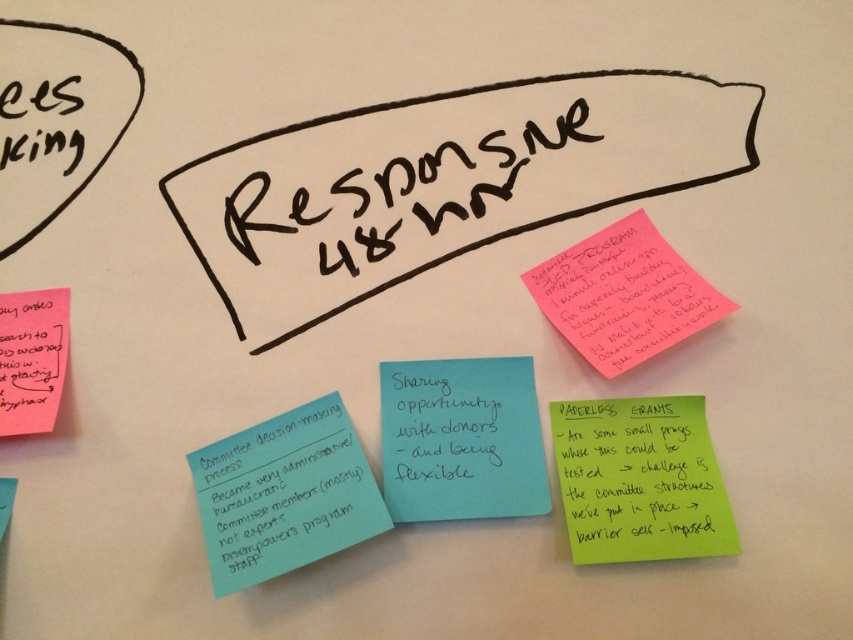
Question: From the image, what is the correct spatial relationship of green paper at lower right in relation to teal paper note at center-left?

Choices:
 (A) above
 (B) below

Answer: (A)

Question: Does teal paper note at center-left appear on the right side of pink paper at upper right?

Choices:
 (A) yes
 (B) no

Answer: (B)

Question: Which of the following is the farthest from the observer?

Choices:
 (A) blue paper at center
 (B) green paper at lower right

Answer: (A)

Question: Does black marker text on white paper at center appear on the right side of green paper at lower right?

Choices:
 (A) yes
 (B) no

Answer: (B)

Question: Which object is farther from the camera taking this photo?

Choices:
 (A) teal paper note at center-left
 (B) black marker text on white paper at center
 (C) green paper at lower right

Answer: (B)

Question: Among these points, which one is farthest from the camera?

Choices:
 (A) (662, 132)
 (B) (572, 280)
 (C) (231, 477)

Answer: (A)